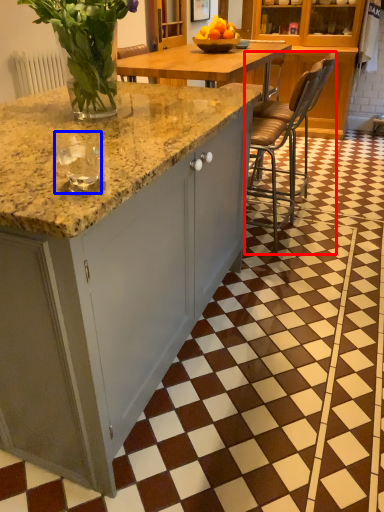
Question: Which object is closer to the camera taking this photo, chair (highlighted by a red box) or wine glass (highlighted by a blue box)?

Choices:
 (A) chair
 (B) wine glass

Answer: (B)